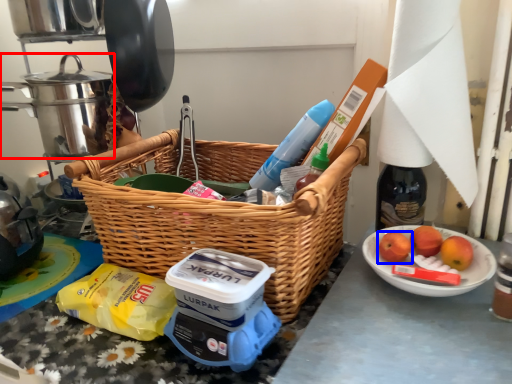
Question: Which object is further to the camera taking this photo, crock pot (highlighted by a red box) or apple (highlighted by a blue box)?

Choices:
 (A) crock pot
 (B) apple

Answer: (A)